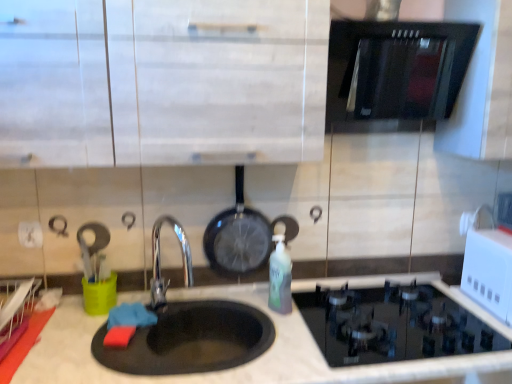
This screenshot has width=512, height=384. I want to click on translucent green bottle at center, so click(280, 277).

What is the approximate height of black glass oven at upper right?

It is 14.98 inches.

The width and height of the screenshot is (512, 384). What do you see at coordinates (219, 80) in the screenshot? I see `white matte cabinet at upper center` at bounding box center [219, 80].

Measure the distance between point (337, 313) and camera.

Point (337, 313) is 4.99 feet away from camera.

Image resolution: width=512 pixels, height=384 pixels. Find the location of `white glossy microwave at upper right`. white glossy microwave at upper right is located at coordinates (489, 271).

Considering the relative sizes of black matte wok at center and black glass gas stove at lower right in the image provided, is black matte wok at center shorter than black glass gas stove at lower right?

In fact, black matte wok at center may be taller than black glass gas stove at lower right.

From the image's perspective, who appears lower, black matte wok at center or black glass gas stove at lower right?

black glass gas stove at lower right is shown below in the image.

Does point (250, 208) appear closer or farther from the camera than point (361, 346)?

Point (250, 208).

Could you tell me if black matte wok at center is facing black glass gas stove at lower right?

No, black matte wok at center is not turned towards black glass gas stove at lower right.

Is translucent green bottle at center to the left of black glass oven at upper right from the viewer's perspective?

Correct, you'll find translucent green bottle at center to the left of black glass oven at upper right.

Is point (287, 306) closer or farther from the camera than point (366, 100)?

Clearly, point (287, 306) is more distant from the camera than point (366, 100).

Is translucent green bottle at center smaller than black glass oven at upper right?

Yes.

This screenshot has width=512, height=384. Identify the location of bottle behind the black glass oven at upper right. (280, 277).

Is black glass gas stove at lower right located outside white marble countertop at center?

black glass gas stove at lower right lies outside white marble countertop at center's area.

Can you confirm if black glass gas stove at lower right is positioned to the right of white marble countertop at center?

Indeed, black glass gas stove at lower right is positioned on the right side of white marble countertop at center.

Between black glass gas stove at lower right and white marble countertop at center, which one has smaller width?

black glass gas stove at lower right.

Is black matte wok at center positioned with its back to black glass oven at upper right?

No, black matte wok at center's orientation is not away from black glass oven at upper right.

Consider the image. Is black matte wok at center located outside black glass oven at upper right?

Absolutely, black matte wok at center is external to black glass oven at upper right.

Between black matte wok at center and black glass oven at upper right, which one appears on the right side from the viewer's perspective?

From the viewer's perspective, black glass oven at upper right appears more on the right side.

Is black glass gas stove at lower right not near black glass oven at upper right?

No, black glass gas stove at lower right is not far away from black glass oven at upper right.

Does point (396, 353) come closer to viewer compared to point (368, 75)?

Yes.

Who is taller, black glass gas stove at lower right or black glass oven at upper right?

black glass oven at upper right.

Considering the positions of objects black glass gas stove at lower right and black glass oven at upper right in the image provided, who is more to the left, black glass gas stove at lower right or black glass oven at upper right?

black glass oven at upper right is more to the left.

Looking at this image, from a real-world perspective, is black matte wok at center beneath translucent green bottle at center?

No.

Considering the sizes of objects black matte wok at center and translucent green bottle at center in the image provided, who is taller, black matte wok at center or translucent green bottle at center?

Standing taller between the two is black matte wok at center.

Considering the relative sizes of black matte wok at center and translucent green bottle at center in the image provided, is black matte wok at center wider than translucent green bottle at center?

In fact, black matte wok at center might be narrower than translucent green bottle at center.

Can we say white matte cabinet at upper center lies outside white glossy microwave at upper right?

Yes, white matte cabinet at upper center is outside of white glossy microwave at upper right.

From a real-world perspective, who is located lower, white matte cabinet at upper center or white glossy microwave at upper right?

From a 3D spatial view, white glossy microwave at upper right is below.

Is white matte cabinet at upper center oriented away from white glossy microwave at upper right?

white matte cabinet at upper center is not turned away from white glossy microwave at upper right.

Which of these two, white matte cabinet at upper center or white glossy microwave at upper right, is wider?

With larger width is white matte cabinet at upper center.

Locate an element on the screen. The image size is (512, 384). gas stove beneath the black matte wok at center (from a real-world perspective) is located at coordinates (392, 324).

In order to click on oven on the right of translucent green bottle at center in this screenshot , I will do `click(398, 68)`.

Considering their positions, is white matte cabinet at upper center positioned further to white marble countertop at center than black glass gas stove at lower right?

The object further to white marble countertop at center is white matte cabinet at upper center.

From the image, which object appears to be nearer to white matte cabinet at upper center, translucent green bottle at center or black glass oven at upper right?

black glass oven at upper right lies closer to white matte cabinet at upper center than the other object.

Based on their spatial positions, is black glass gas stove at lower right or white matte cabinet at upper center further from black matte wok at center?

white matte cabinet at upper center is further to black matte wok at center.

Considering their positions, is white matte cabinet at upper center positioned further to black glass gas stove at lower right than translucent green bottle at center?

white matte cabinet at upper center is positioned further to the anchor black glass gas stove at lower right.

When comparing their distances from black matte pizza pan at lower center, does white matte cabinet at upper center or black glass gas stove at lower right seem further?

Among the two, white matte cabinet at upper center is located further to black matte pizza pan at lower center.

Considering their positions, is white glossy microwave at upper right positioned closer to black glass oven at upper right than white marble countertop at center?

white glossy microwave at upper right lies closer to black glass oven at upper right than the other object.

Which object lies further to the anchor point translucent green bottle at center, black glass gas stove at lower right or black matte pizza pan at lower center?

black glass gas stove at lower right.

Which object lies further to the anchor point black matte pizza pan at lower center, black matte wok at center or black glass oven at upper right?

Among the two, black glass oven at upper right is located further to black matte pizza pan at lower center.

You are a GUI agent. You are given a task and a screenshot of the screen. Output one action in this format:
    pyautogui.click(x=<x>, y=<y>)
    Task: Click on the gas stove between black matte pizza pan at lower center and white glossy microwave at upper right from left to right
    
    Given the screenshot: What is the action you would take?
    392,324

Find the location of a particular element. This screenshot has height=384, width=512. bottle between black matte pizza pan at lower center and black glass gas stove at lower right from left to right is located at coordinates (280, 277).

Locate an element on the screen. This screenshot has height=384, width=512. countertop between white matte cabinet at upper center and white glossy microwave at upper right from left to right is located at coordinates (245, 364).

The image size is (512, 384). I want to click on pizza pan between black glass oven at upper right and white marble countertop at center in the vertical direction, so click(191, 339).